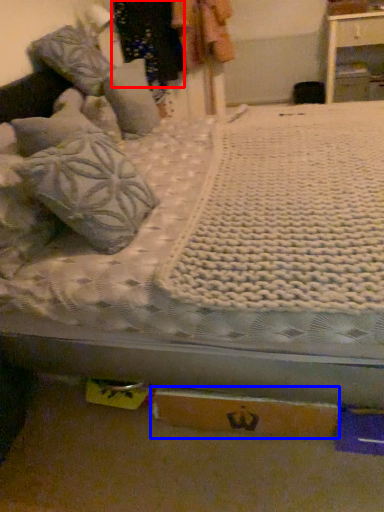
Question: Which object appears closest to the camera in this image, clothing (highlighted by a red box) or cardboard box (highlighted by a blue box)?

Choices:
 (A) clothing
 (B) cardboard box

Answer: (B)